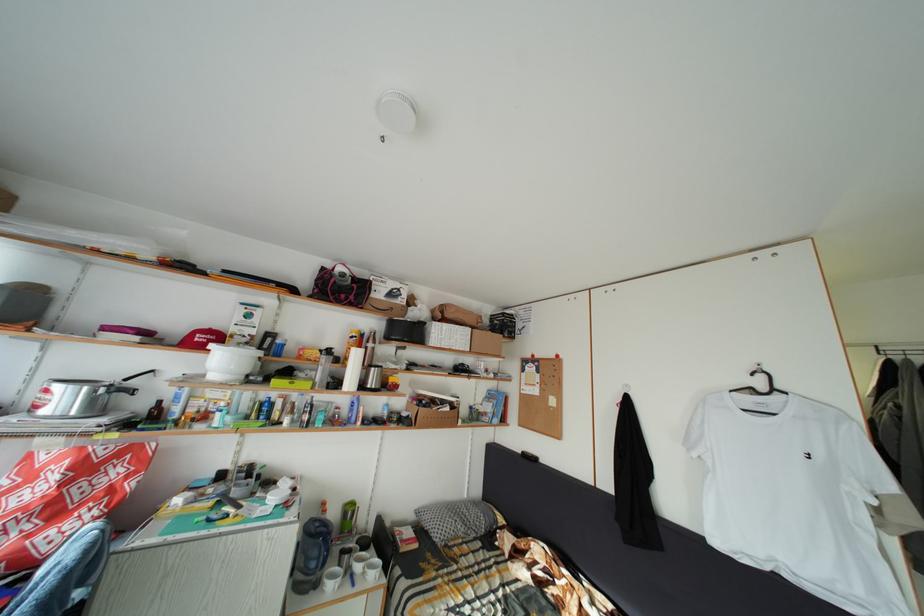
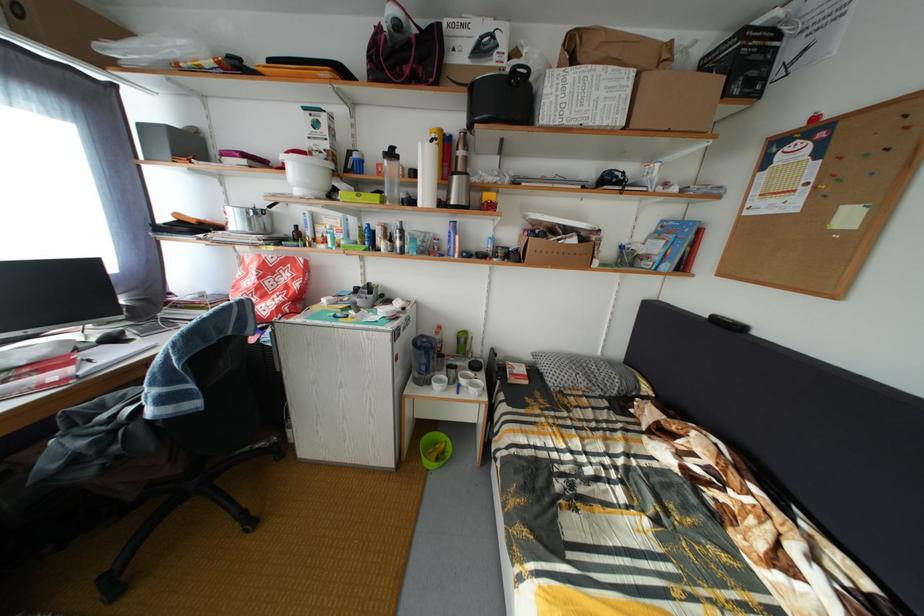
Find the pixel in the second image that matches (x=112, y=459) in the first image.

(281, 267)